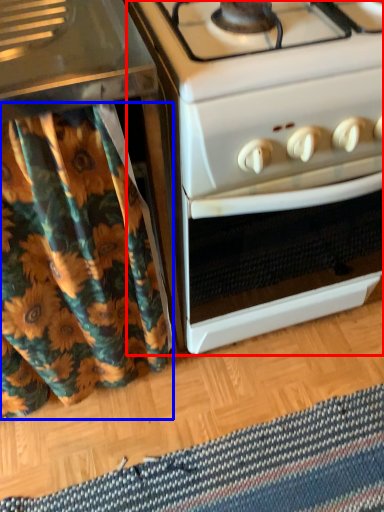
Question: Among these objects, which one is nearest to the camera, oven (highlighted by a red box) or shower curtain (highlighted by a blue box)?

Choices:
 (A) oven
 (B) shower curtain

Answer: (B)